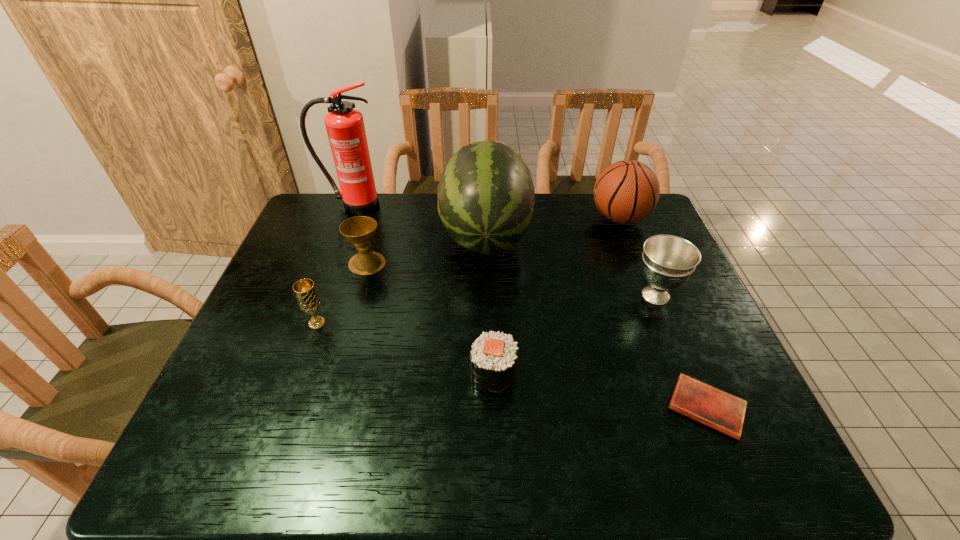
Where is `fire extinguisher`? Image resolution: width=960 pixels, height=540 pixels. fire extinguisher is located at coordinates (345, 127).

Where is `the seventh shortest object`? The height and width of the screenshot is (540, 960). the seventh shortest object is located at coordinates (486, 195).

Locate an element on the screen. This screenshot has width=960, height=540. the third tallest object is located at coordinates (627, 191).

This screenshot has height=540, width=960. What are the coordinates of `the second nearest chalice` in the screenshot? It's located at (668, 261).

Locate an element on the screen. The width and height of the screenshot is (960, 540). the rightmost chalice is located at coordinates pyautogui.click(x=668, y=261).

The image size is (960, 540). Find the location of `the second chalice from left to right`. the second chalice from left to right is located at coordinates (359, 231).

The height and width of the screenshot is (540, 960). I want to click on the nearest chalice, so click(308, 299).

Identify the location of the leftmost chalice. The height and width of the screenshot is (540, 960). (308, 299).

What are the coordinates of `sushi` in the screenshot? It's located at (493, 356).

In order to click on diary in this screenshot , I will do `click(724, 412)`.